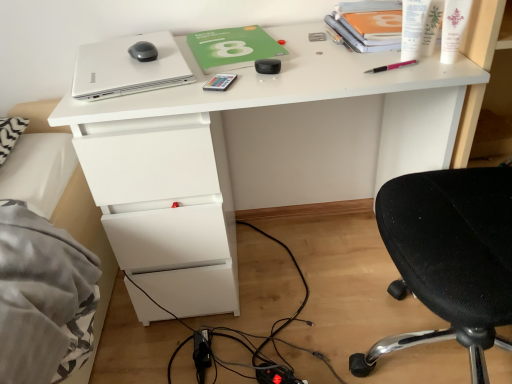
The width and height of the screenshot is (512, 384). I want to click on vacant space in between metallic rectangular object at center, the 1th stationery in the left-to-right sequence, and white paper towel at upper right, positioned as the fourth stationery in left-to-right order, so click(314, 70).